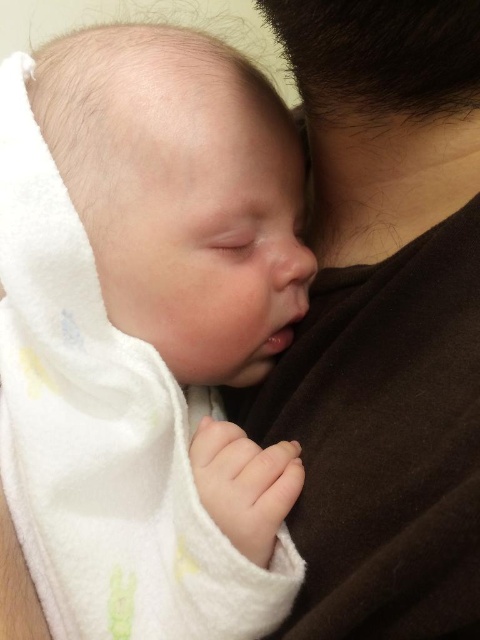
Is white soft towel at center positioned at the back of brown soft fabric at upper right?

Yes, it is behind brown soft fabric at upper right.

Is white soft towel at center to the right of brown soft fabric at upper right from the viewer's perspective?

Incorrect, white soft towel at center is not on the right side of brown soft fabric at upper right.

Is point (66, 336) positioned in front of point (467, 317)?

No, it is not.

Where is `white soft towel at center`? The image size is (480, 640). white soft towel at center is located at coordinates (146, 332).